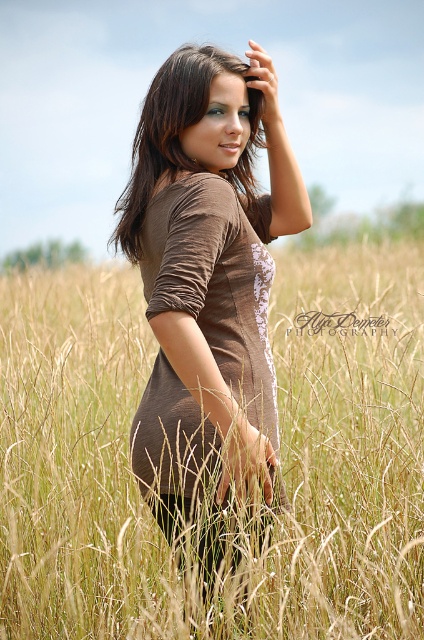
Can you confirm if golden wheat field at center is positioned to the right of brown shiny hair at center?

Incorrect, golden wheat field at center is not on the right side of brown shiny hair at center.

Is point (180, 628) positioned behind point (125, 193)?

No, it is not.

Identify the location of golden wheat field at center. (281, 460).

Who is positioned more to the right, brown matte dress at center or brown textured dress at center?

brown matte dress at center

Can you confirm if brown matte dress at center is thinner than brown textured dress at center?

No.

Find the location of a particular element. The image size is (424, 640). brown matte dress at center is located at coordinates (208, 280).

Between brown textured dress at center and brown shiny hair at center, which one has less height?

With less height is brown shiny hair at center.

Which is in front, point (222, 337) or point (245, 164)?

Point (222, 337) is in front.

Is point (190, 426) farther from camera compared to point (192, 74)?

No, (190, 426) is in front of (192, 74).

Image resolution: width=424 pixels, height=640 pixels. I want to click on brown textured dress at center, so click(x=215, y=282).